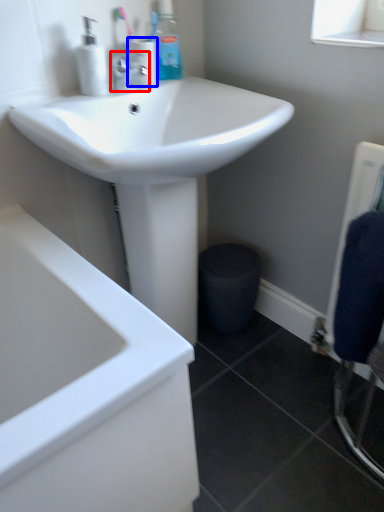
Question: Which point is further to the camera, tap (highlighted by a red box) or toiletry (highlighted by a blue box)?

Choices:
 (A) tap
 (B) toiletry

Answer: (B)